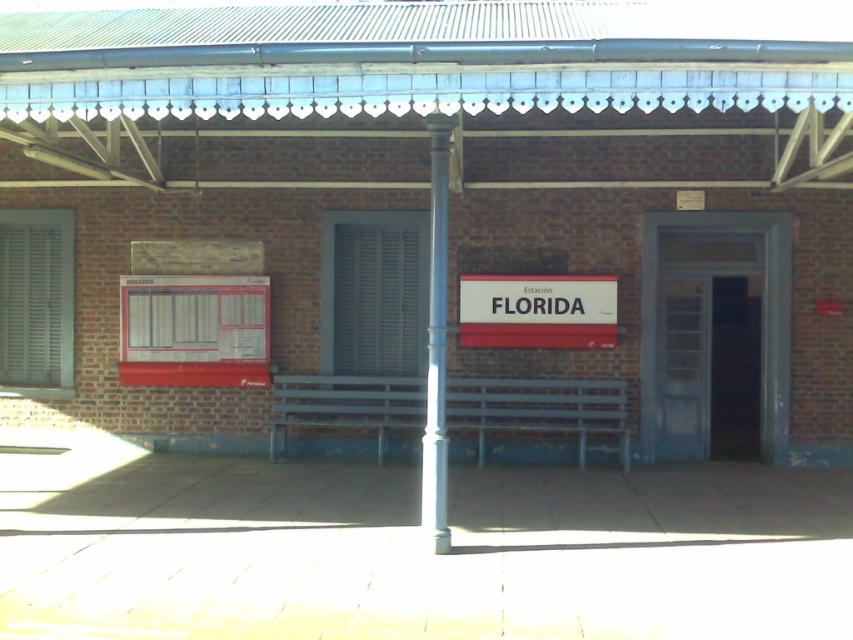
Is white wooden shutter at left thinner than metallic gray pole at center?

Incorrect, white wooden shutter at left's width is not less than metallic gray pole at center's.

Which is in front, point (38, 300) or point (439, 154)?

Point (439, 154) is more forward.

Image resolution: width=853 pixels, height=640 pixels. Identify the location of white wooden shutter at left. (35, 301).

Is white matte shutter at center behind white wooden shutter at left?

No, white matte shutter at center is closer to the viewer.

Is point (338, 237) closer to viewer compared to point (28, 227)?

Yes.

The image size is (853, 640). Describe the element at coordinates (379, 298) in the screenshot. I see `white matte shutter at center` at that location.

Where is `white matte shutter at center`? This screenshot has width=853, height=640. white matte shutter at center is located at coordinates (379, 298).

Between point (608, 317) and point (432, 358), which one is positioned behind?

The point (608, 317) is more distant.

Is white matte sign at center further to the viewer compared to metallic gray pole at center?

Yes, it is behind metallic gray pole at center.

Between point (482, 316) and point (440, 170), which one is positioned in front?

Positioned in front is point (440, 170).

Locate an element on the screen. Image resolution: width=853 pixels, height=640 pixels. white matte sign at center is located at coordinates (537, 310).